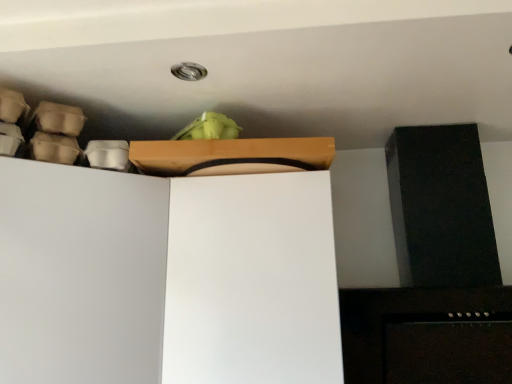
Question: Should I look upward or downward to see white matte cabinet at upper left?

Choices:
 (A) up
 (B) down

Answer: (B)

Question: From a real-world perspective, is wooden box at upper center located higher than white matte cabinet at upper left?

Choices:
 (A) yes
 (B) no

Answer: (A)

Question: Does wooden box at upper center turn towards white matte cabinet at upper left?

Choices:
 (A) no
 (B) yes

Answer: (A)

Question: Does wooden box at upper center have a smaller size compared to white matte cabinet at upper left?

Choices:
 (A) no
 (B) yes

Answer: (B)

Question: From the image's perspective, would you say wooden box at upper center is positioned over white matte cabinet at upper left?

Choices:
 (A) yes
 (B) no

Answer: (A)

Question: Considering the relative sizes of wooden box at upper center and white matte cabinet at upper left in the image provided, is wooden box at upper center wider than white matte cabinet at upper left?

Choices:
 (A) no
 (B) yes

Answer: (A)

Question: Does wooden box at upper center have a larger size compared to white matte cabinet at upper left?

Choices:
 (A) yes
 (B) no

Answer: (B)

Question: From a real-world perspective, is white matte cabinet at upper left under wooden box at upper center?

Choices:
 (A) no
 (B) yes

Answer: (B)

Question: Is white matte cabinet at upper left not inside wooden box at upper center?

Choices:
 (A) yes
 (B) no

Answer: (A)

Question: Considering the relative sizes of white matte cabinet at upper left and wooden box at upper center in the image provided, is white matte cabinet at upper left thinner than wooden box at upper center?

Choices:
 (A) no
 (B) yes

Answer: (A)

Question: Is white matte cabinet at upper left closer to camera compared to wooden box at upper center?

Choices:
 (A) no
 (B) yes

Answer: (B)

Question: Can you confirm if white matte cabinet at upper left is positioned to the right of wooden box at upper center?

Choices:
 (A) yes
 (B) no

Answer: (B)

Question: From a real-world perspective, is white matte cabinet at upper left on top of wooden box at upper center?

Choices:
 (A) no
 (B) yes

Answer: (A)

Question: Considering the positions of point (311, 137) and point (210, 195), is point (311, 137) closer or farther from the camera than point (210, 195)?

Choices:
 (A) farther
 (B) closer

Answer: (A)